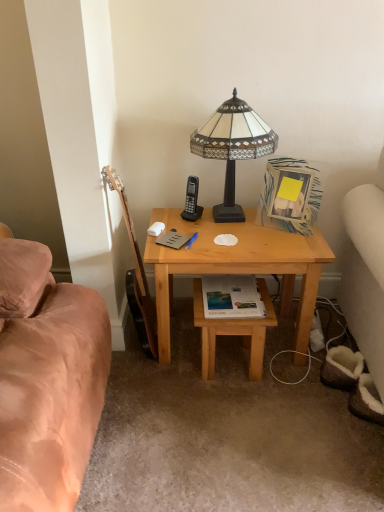
The image size is (384, 512). Find the location of `free region under brown wood guitar at left (from a real-world perspective)`. free region under brown wood guitar at left (from a real-world perspective) is located at coordinates (142, 358).